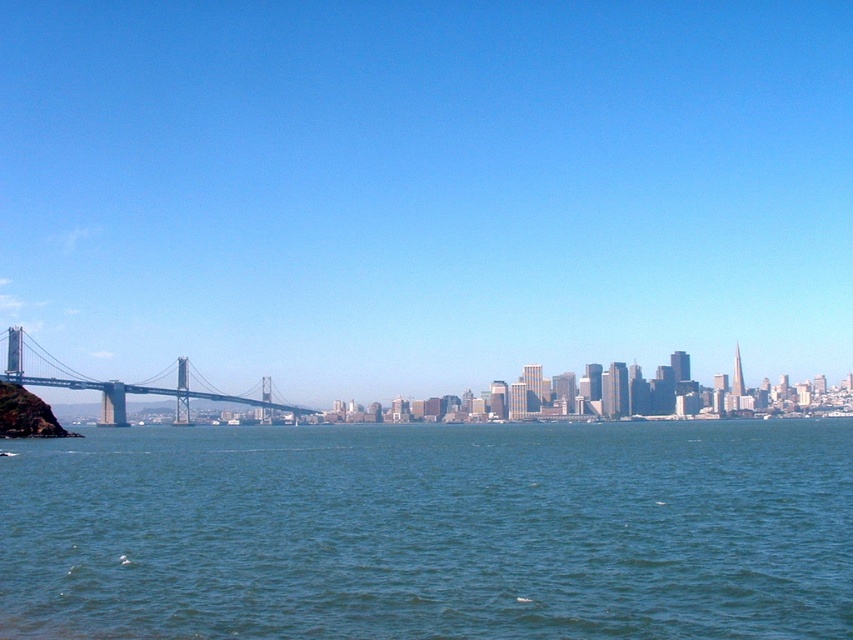
Is green water at lower center in front of metallic gray bridge at left?

Yes.

Locate an element on the screen. The height and width of the screenshot is (640, 853). green water at lower center is located at coordinates (431, 531).

From the picture: Does transparent glass bridge at center appear under metallic gray bridge at left?

No.

This screenshot has width=853, height=640. In order to click on transparent glass bridge at center in this screenshot , I will do 426,188.

Identify the location of transparent glass bridge at center. (426, 188).

Measure the distance between transparent glass bridge at center and green water at lower center.

transparent glass bridge at center is 294.30 meters from green water at lower center.

Between transparent glass bridge at center and green water at lower center, which one appears on the right side from the viewer's perspective?

green water at lower center is more to the right.

What do you see at coordinates (426, 188) in the screenshot?
I see `transparent glass bridge at center` at bounding box center [426, 188].

I want to click on transparent glass bridge at center, so click(x=426, y=188).